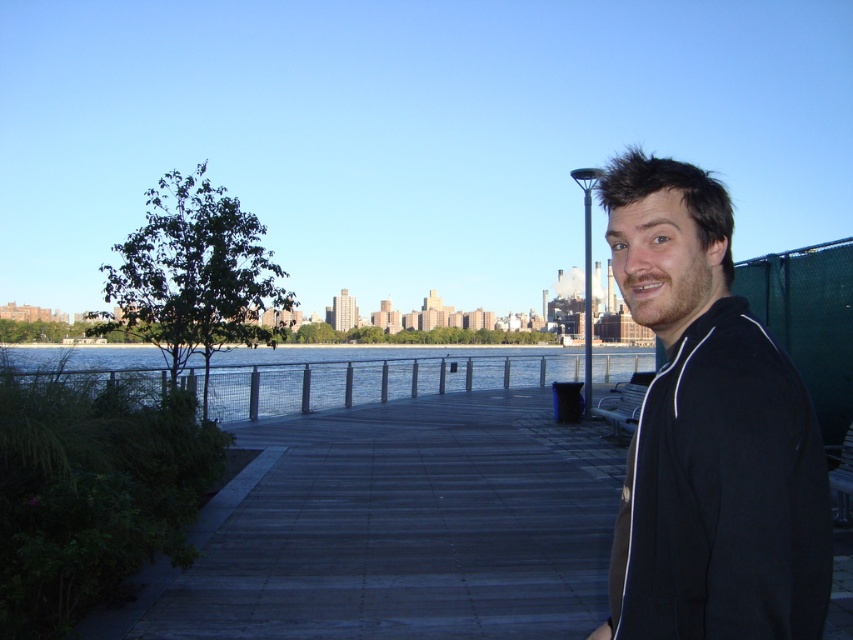
You are standing at the starting point of the walkway and want to reach the end of the walkway. Which point, point (718, 529) or point (221, 368), is closer to your current position?

Point (718, 529) is closer to your current position because it is in front of point (221, 368), meaning it is nearer to the starting point of the walkway.

You are standing on the walkway and notice two features ahead. One is wooden planks at center and the other is clear water at center. Which one is located to the right of the other?

The wooden planks at center is positioned on the right side of clear water at center.